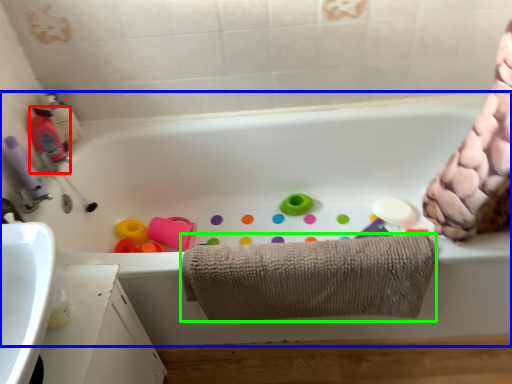
Question: Which object is positioned closest to cleaning product (highlighted by a red box)? Select from bathtub (highlighted by a blue box) and towel (highlighted by a green box).

Choices:
 (A) bathtub
 (B) towel

Answer: (A)